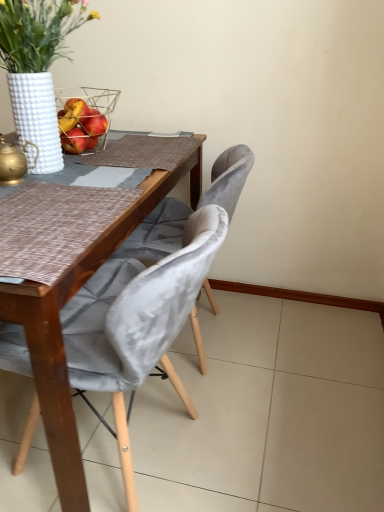
What do you see at coordinates (37, 70) in the screenshot? I see `white textured vase at upper left` at bounding box center [37, 70].

What is the approximate width of velvet grey chair at center, acting as the first chair starting from the front?

21.32 inches.

Locate an element on the screen. The image size is (384, 512). white textured vase at upper left is located at coordinates coord(37,70).

Considering the relative sizes of white textured vase at upper left and metallic wire picnic basket at upper left in the image provided, is white textured vase at upper left shorter than metallic wire picnic basket at upper left?

In fact, white textured vase at upper left may be taller than metallic wire picnic basket at upper left.

Is the surface of white textured vase at upper left in direct contact with metallic wire picnic basket at upper left?

No, white textured vase at upper left is not making contact with metallic wire picnic basket at upper left.

From the picture: Is white textured vase at upper left smaller than metallic wire picnic basket at upper left?

Incorrect, white textured vase at upper left is not smaller in size than metallic wire picnic basket at upper left.

The width and height of the screenshot is (384, 512). I want to click on picnic basket that appears above the white textured vase at upper left (from the image's perspective), so click(x=85, y=117).

Considering the relative sizes of white textured vase at upper left and velvet grey chair at center, placed as the 2th chair when sorted from back to front, in the image provided, is white textured vase at upper left bigger than velvet grey chair at center, placed as the 2th chair when sorted from back to front,?

No, white textured vase at upper left is not bigger than velvet grey chair at center, placed as the 2th chair when sorted from back to front.

Relative to velvet grey chair at center, acting as the first chair starting from the front, is white textured vase at upper left in front or behind?

Clearly, white textured vase at upper left is behind velvet grey chair at center, acting as the first chair starting from the front.

Could you tell me if white textured vase at upper left is facing velvet grey chair at center, placed as the 2th chair when sorted from back to front?

No, white textured vase at upper left is not oriented towards velvet grey chair at center, placed as the 2th chair when sorted from back to front.

Can you confirm if white textured vase at upper left is thinner than velvet grey chair at center, acting as the first chair starting from the front?

Yes.

Considering the positions of objects metallic wire picnic basket at upper left and velvet grey chair at center, acting as the first chair starting from the front, in the image provided, who is more to the right, metallic wire picnic basket at upper left or velvet grey chair at center, acting as the first chair starting from the front,?

velvet grey chair at center, acting as the first chair starting from the front.

Is metallic wire picnic basket at upper left positioned behind velvet grey chair at center, acting as the first chair starting from the front?

Yes, metallic wire picnic basket at upper left is behind velvet grey chair at center, acting as the first chair starting from the front.

Would you say metallic wire picnic basket at upper left is inside or outside velvet grey chair at center, acting as the first chair starting from the front?

The correct answer is: outside.

Would you consider metallic wire picnic basket at upper left to be distant from velvet grey chair at center, placed as the 2th chair when sorted from back to front?

metallic wire picnic basket at upper left is near velvet grey chair at center, placed as the 2th chair when sorted from back to front, not far away.

How many degrees apart are the facing directions of velvet grey chair at center, acting as the 1th chair starting from the back, and metallic wire picnic basket at upper left?

There is a 90.4-degree angle between the facing directions of velvet grey chair at center, acting as the 1th chair starting from the back, and metallic wire picnic basket at upper left.

In terms of width, does velvet grey chair at center, the 2th chair positioned from the front, look wider or thinner when compared to metallic wire picnic basket at upper left?

Clearly, velvet grey chair at center, the 2th chair positioned from the front, has more width compared to metallic wire picnic basket at upper left.

Considering the points (164, 239) and (69, 148), which point is in front, point (164, 239) or point (69, 148)?

Point (69, 148)

Is velvet grey chair at center, the 2th chair positioned from the front, bigger or smaller than metallic wire picnic basket at upper left?

In the image, velvet grey chair at center, the 2th chair positioned from the front, appears to be larger than metallic wire picnic basket at upper left.

Which of these two, metallic wire picnic basket at upper left or velvet grey chair at center, acting as the 1th chair starting from the back, is thinner?

With smaller width is metallic wire picnic basket at upper left.

Considering the relative sizes of metallic wire picnic basket at upper left and velvet grey chair at center, the 2th chair positioned from the front, in the image provided, is metallic wire picnic basket at upper left smaller than velvet grey chair at center, the 2th chair positioned from the front,?

Yes.

Who is more distant, metallic wire picnic basket at upper left or velvet grey chair at center, the 2th chair positioned from the front?

metallic wire picnic basket at upper left.

Which is more to the left, metallic wire picnic basket at upper left or velvet grey chair at center, the 2th chair positioned from the front?

From the viewer's perspective, metallic wire picnic basket at upper left appears more on the left side.

Does gold metallic teapot at left appear on the left side of metallic wire picnic basket at upper left?

Yes.

Looking at this image, in terms of width, does gold metallic teapot at left look wider or thinner when compared to metallic wire picnic basket at upper left?

Clearly, gold metallic teapot at left has less width compared to metallic wire picnic basket at upper left.

Does gold metallic teapot at left have a greater height compared to metallic wire picnic basket at upper left?

No, gold metallic teapot at left is not taller than metallic wire picnic basket at upper left.

You are a GUI agent. You are given a task and a screenshot of the screen. Output one action in this format:
    pyautogui.click(x=<x>, y=<y>)
    Task: Click on the tea pot on the left side of metallic wire picnic basket at upper left
    This screenshot has height=512, width=384.
    Given the screenshot: What is the action you would take?
    pyautogui.click(x=14, y=162)

Is white textured vase at upper left outside of velvet grey chair at center, acting as the 1th chair starting from the back?

white textured vase at upper left is positioned outside velvet grey chair at center, acting as the 1th chair starting from the back.

Which of these two, white textured vase at upper left or velvet grey chair at center, acting as the 1th chair starting from the back, is wider?

velvet grey chair at center, acting as the 1th chair starting from the back.

From a real-world perspective, who is located higher, white textured vase at upper left or velvet grey chair at center, the 2th chair positioned from the front?

From a 3D spatial view, white textured vase at upper left is above.

Locate an element on the screen. houseplant in front of the metallic wire picnic basket at upper left is located at coordinates (37, 70).

Where is `houseplant above the velvet grey chair at center, placed as the 2th chair when sorted from back to front (from a real-world perspective)`? The height and width of the screenshot is (512, 384). houseplant above the velvet grey chair at center, placed as the 2th chair when sorted from back to front (from a real-world perspective) is located at coordinates (37, 70).

From the image, which object appears to be nearer to velvet grey chair at center, placed as the 2th chair when sorted from back to front, gold metallic teapot at left or metallic wire picnic basket at upper left?

gold metallic teapot at left is closer to velvet grey chair at center, placed as the 2th chair when sorted from back to front.

Considering their positions, is gold metallic teapot at left positioned further to metallic wire picnic basket at upper left than white textured vase at upper left?

gold metallic teapot at left lies further to metallic wire picnic basket at upper left than the other object.

When comparing their distances from white textured vase at upper left, does velvet grey chair at center, acting as the first chair starting from the front, or velvet grey chair at center, acting as the 1th chair starting from the back, seem further?

velvet grey chair at center, acting as the first chair starting from the front, is positioned further to the anchor white textured vase at upper left.

When comparing their distances from metallic wire picnic basket at upper left, does velvet grey chair at center, acting as the 1th chair starting from the back, or white textured vase at upper left seem further?

The object further to metallic wire picnic basket at upper left is velvet grey chair at center, acting as the 1th chair starting from the back.

Based on their spatial positions, is white textured vase at upper left or gold metallic teapot at left closer to metallic wire picnic basket at upper left?

white textured vase at upper left is closer to metallic wire picnic basket at upper left.

When comparing their distances from velvet grey chair at center, acting as the first chair starting from the front, does white textured vase at upper left or velvet grey chair at center, acting as the 1th chair starting from the back, seem closer?

velvet grey chair at center, acting as the 1th chair starting from the back, is positioned closer to the anchor velvet grey chair at center, acting as the first chair starting from the front.

Which object lies further to the anchor point gold metallic teapot at left, white textured vase at upper left or velvet grey chair at center, placed as the 2th chair when sorted from back to front?

Based on the image, velvet grey chair at center, placed as the 2th chair when sorted from back to front, appears to be further to gold metallic teapot at left.

Which object lies nearer to the anchor point velvet grey chair at center, acting as the 1th chair starting from the back, velvet grey chair at center, placed as the 2th chair when sorted from back to front, or metallic wire picnic basket at upper left?

velvet grey chair at center, placed as the 2th chair when sorted from back to front, is positioned closer to the anchor velvet grey chair at center, acting as the 1th chair starting from the back.

I want to click on tea pot between white textured vase at upper left and metallic wire picnic basket at upper left in the front-back direction, so click(14, 162).

At what (x,y) coordinates should I click in order to perform the action: click on tea pot between metallic wire picnic basket at upper left and velvet grey chair at center, acting as the 1th chair starting from the back, vertically. Please return your answer as a coordinate pair (x, y). The image size is (384, 512). Looking at the image, I should click on [14, 162].

The height and width of the screenshot is (512, 384). Identify the location of chair between white textured vase at upper left and velvet grey chair at center, placed as the 2th chair when sorted from back to front, from top to bottom. (157, 233).

This screenshot has width=384, height=512. What are the coordinates of `houseplant between gold metallic teapot at left and velvet grey chair at center, the 2th chair positioned from the front, in the horizontal direction` in the screenshot? It's located at (37, 70).